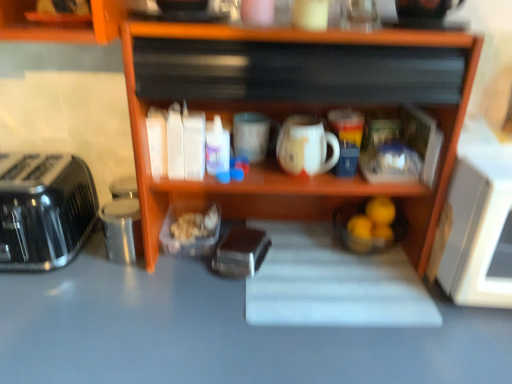
The height and width of the screenshot is (384, 512). What are the coordinates of `empty space that is ontop of smooth gray countertop at center` in the screenshot? It's located at (209, 291).